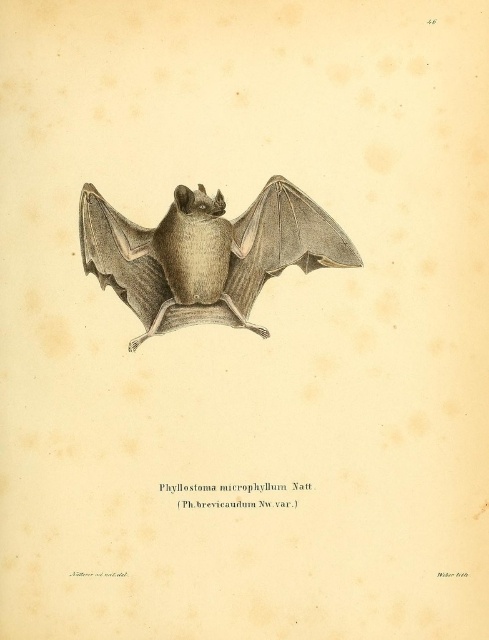
You are an animal researcher examining the bat illustration. The coordinates point to a specific location on the bat. What is the feature located at point (206,253)?

The point (206,253) corresponds to the gray textured bat at center.

You are an artist trying to recreate this bat illustration. You notice two distinct gray wings labeled as gray textured wing at center and matte gray wing at center. How far apart are these two wings in inches?

The gray textured wing at center and matte gray wing at center are 8.08 inches apart from each other.

You are an artist examining the bat illustration. You notice two wings labeled as gray textured wing at center and matte gray wing at center. Which one has a larger size?

The gray textured wing at center is bigger than the matte gray wing at center.